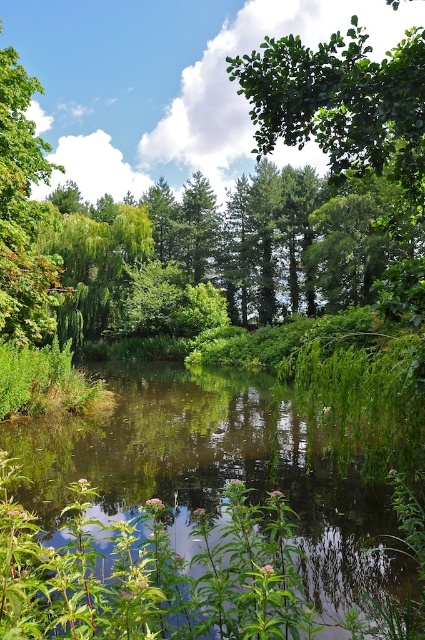
Question: Does green leafy river at center come behind green leafy tree at upper center?

Choices:
 (A) yes
 (B) no

Answer: (B)

Question: Among these points, which one is farthest from the camera?

Choices:
 (A) (198, 625)
 (B) (289, 45)
 (C) (48, 323)

Answer: (C)

Question: Considering the real-world distances, which object is closest to the green leafy river at center?

Choices:
 (A) green leafy tree at upper center
 (B) green leafy tree at upper left

Answer: (B)

Question: Is green leafy river at center above green leafy tree at upper left?

Choices:
 (A) yes
 (B) no

Answer: (B)

Question: Which point appears closest to the camera in this image?

Choices:
 (A) (99, 513)
 (B) (323, 108)
 (C) (39, 216)

Answer: (B)

Question: Is green leafy river at center wider than green leafy tree at upper left?

Choices:
 (A) no
 (B) yes

Answer: (A)